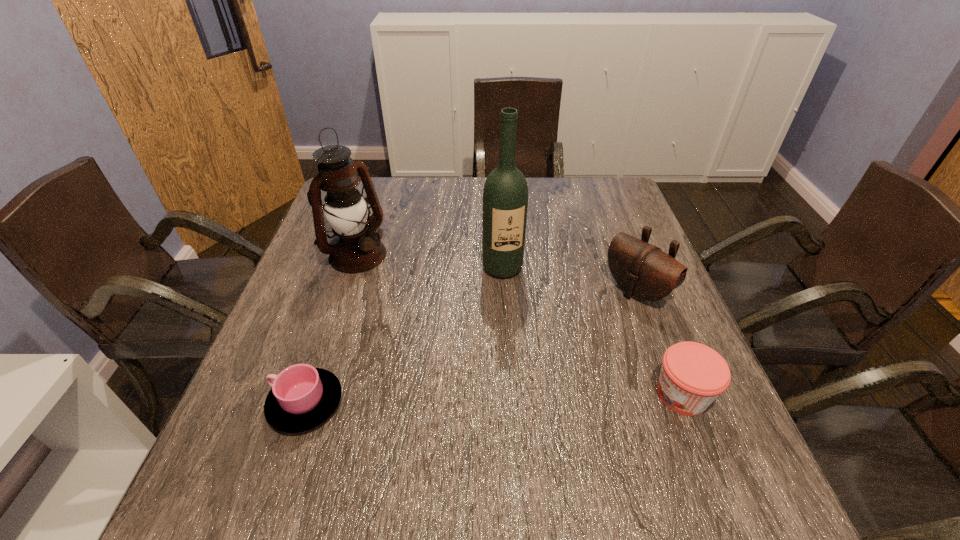
Where is `lantern that is at the left edge`? The width and height of the screenshot is (960, 540). lantern that is at the left edge is located at coordinates (356, 247).

Locate an element on the screen. The width and height of the screenshot is (960, 540). jam that is positioned at the right edge is located at coordinates (693, 375).

At what (x,y) coordinates should I click in order to perform the action: click on pouch situated at the right edge. Please return your answer as a coordinate pair (x, y). Looking at the image, I should click on (643, 271).

What are the coordinates of `object that is at the near left corner` in the screenshot? It's located at (302, 397).

The height and width of the screenshot is (540, 960). In order to click on object situated at the near right corner in this screenshot , I will do `click(693, 375)`.

Locate an element on the screen. The image size is (960, 540). vacant space at the far edge of the desktop is located at coordinates (536, 198).

Locate an element on the screen. The width and height of the screenshot is (960, 540). blank space at the near edge of the desktop is located at coordinates (575, 418).

In the image, there is a desktop. Where is `vacant space at the left edge`? Image resolution: width=960 pixels, height=540 pixels. vacant space at the left edge is located at coordinates (310, 328).

Find the location of `vacant space at the right edge of the desktop`. vacant space at the right edge of the desktop is located at coordinates (595, 221).

The image size is (960, 540). I want to click on vacant space at the far left corner of the desktop, so click(x=374, y=179).